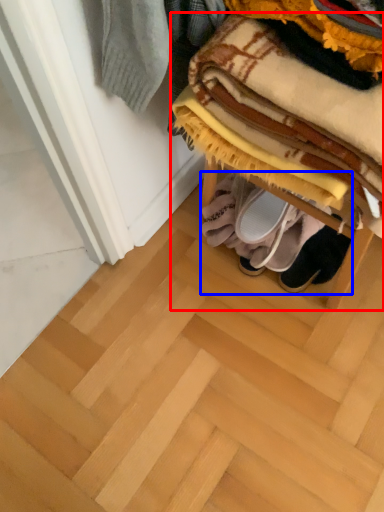
Question: Which object appears farthest to the camera in this image, furniture (highlighted by a red box) or footwear (highlighted by a blue box)?

Choices:
 (A) furniture
 (B) footwear

Answer: (B)